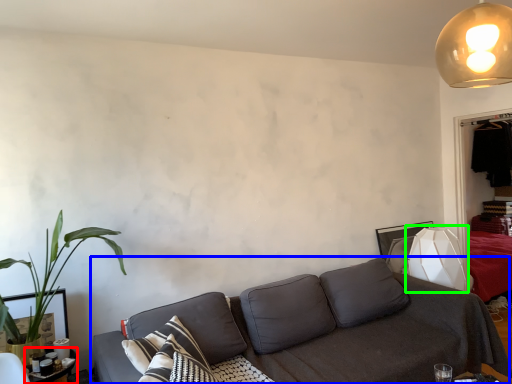
Question: Estimate the real-world distances between objects in this image. Which object is closer to table (highlighted by a red box), studio couch (highlighted by a blue box) or table lamp (highlighted by a green box)?

Choices:
 (A) studio couch
 (B) table lamp

Answer: (A)